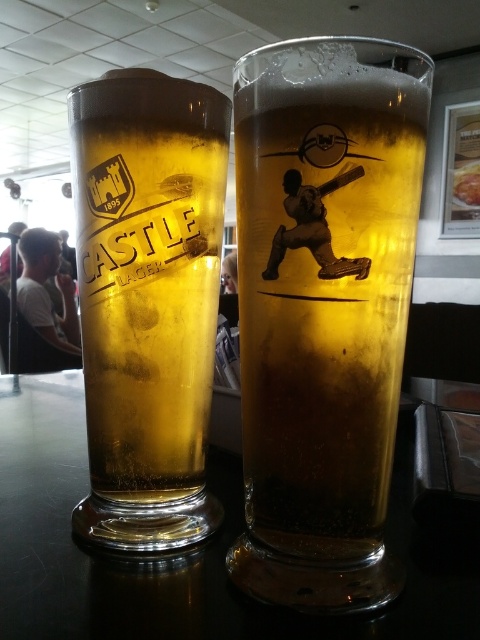
Does translucent glass beer at center appear on the right side of clear glass castle lager at left?

Indeed, translucent glass beer at center is positioned on the right side of clear glass castle lager at left.

Does point (325, 269) come in front of point (92, 179)?

Yes, point (325, 269) is closer to viewer.

Which is in front, point (350, 230) or point (135, 134)?

Point (350, 230) is in front.

At what (x,y) coordinates should I click in order to perform the action: click on translucent glass beer at center. Please return your answer as a coordinate pair (x, y). Looking at the image, I should click on (324, 282).

Is translucent glass beer at center wider than white t-shirt at left?

No, translucent glass beer at center is not wider than white t-shirt at left.

Does translucent glass beer at center have a greater height compared to white t-shirt at left?

No, translucent glass beer at center is not taller than white t-shirt at left.

This screenshot has height=640, width=480. Describe the element at coordinates (324, 282) in the screenshot. I see `translucent glass beer at center` at that location.

In order to click on translucent glass beer at center in this screenshot , I will do `click(324, 282)`.

Between clear glass castle lager at left and transparent glass table at center, which one has more height?

Standing taller between the two is clear glass castle lager at left.

Is point (132, 77) in front of point (418, 577)?

No, (132, 77) is behind (418, 577).

Locate an element on the screen. This screenshot has width=480, height=640. clear glass castle lager at left is located at coordinates (147, 301).